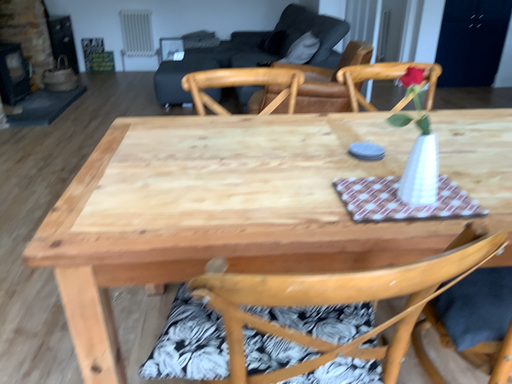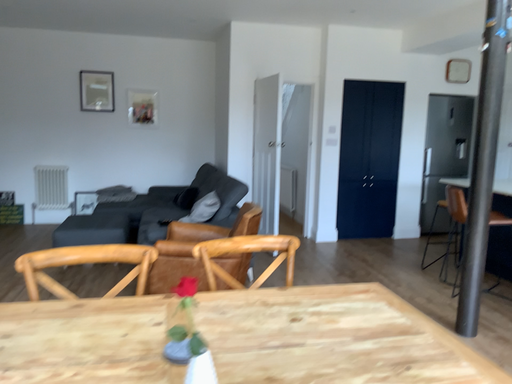
Question: Which way did the camera rotate in the video?

Choices:
 (A) rotated right
 (B) rotated left

Answer: (A)